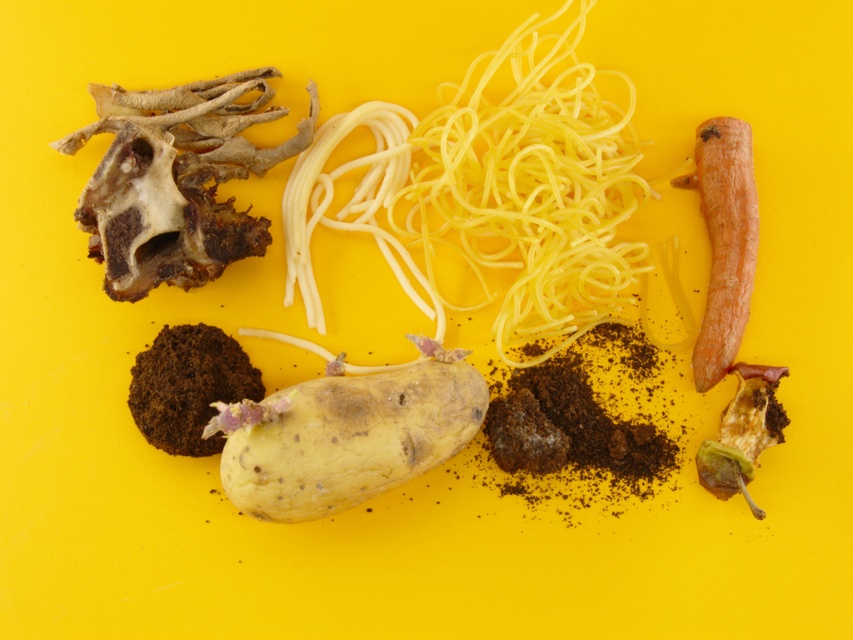
Question: Does speckled yellow potato at center appear over rotten yellow potato at center?

Choices:
 (A) no
 (B) yes

Answer: (A)

Question: Which point appears farthest from the camera in this image?

Choices:
 (A) (444, 408)
 (B) (213, 451)
 (C) (762, 429)
 (D) (401, 198)

Answer: (D)

Question: Considering the real-world distances, which object is closest to the speckled yellow potato at center?

Choices:
 (A) yellow matte spaghetti at center
 (B) brown crumbly soil at center-left
 (C) rotten yellow potato at center

Answer: (B)

Question: From the image, what is the correct spatial relationship of yellow matte spaghetti at center in relation to brown crumbly soil at center-left?

Choices:
 (A) above
 (B) below

Answer: (A)

Question: Which of the following is the farthest from the observer?

Choices:
 (A) (293, 394)
 (B) (703, 483)
 (C) (498, 333)
 (D) (252, 397)

Answer: (C)

Question: Is yellow matte spaghetti at center behind speckled yellow potato at center?

Choices:
 (A) no
 (B) yes

Answer: (B)